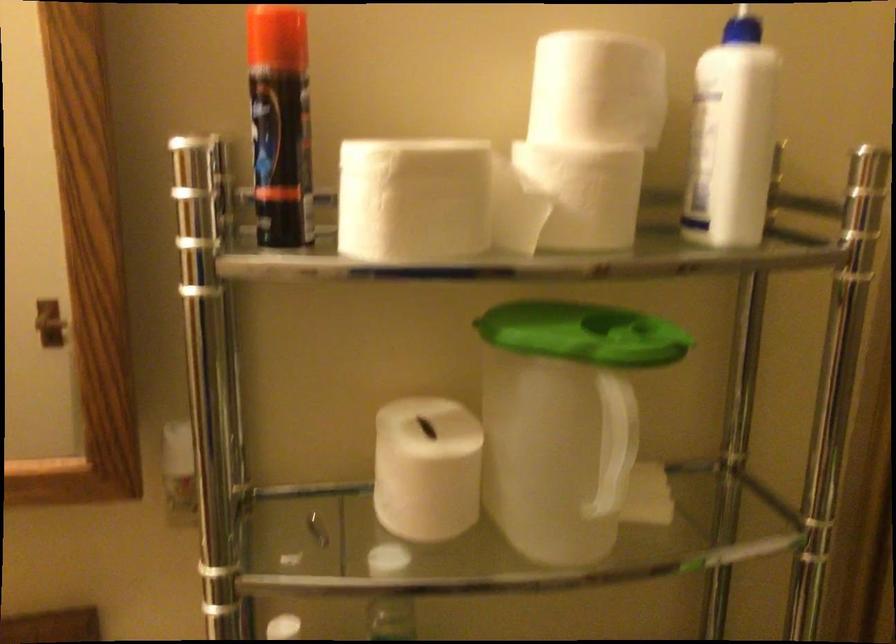
The image size is (896, 644). What are the coordinates of `green pitcher lid` in the screenshot? It's located at (563, 327).